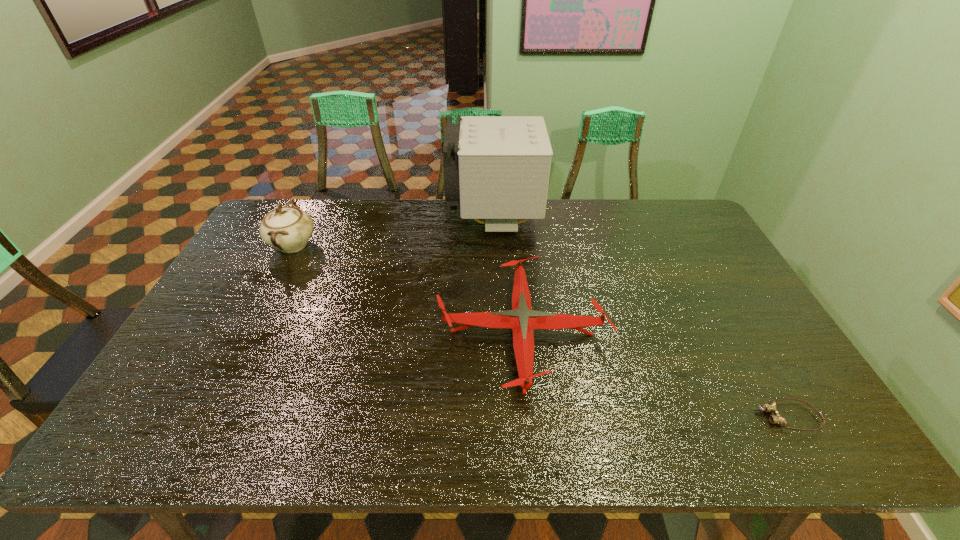
This screenshot has height=540, width=960. In order to click on free location located 0.090m on the front lenses and sides of the rightmost object in this screenshot , I will do `click(720, 417)`.

I want to click on vacant point located on the front lenses and sides of the rightmost object, so click(729, 417).

This screenshot has width=960, height=540. I want to click on fan that is positioned at the far edge, so click(497, 168).

Identify the location of chinaware that is at the far edge. (288, 229).

Locate an element on the screen. The image size is (960, 540). object that is at the near edge is located at coordinates (771, 407).

At what (x,y) coordinates should I click in order to perform the action: click on object that is at the left edge. Please return your answer as a coordinate pair (x, y). This screenshot has height=540, width=960. Looking at the image, I should click on (288, 229).

The image size is (960, 540). Find the location of `object situated at the right edge`. object situated at the right edge is located at coordinates (771, 407).

The width and height of the screenshot is (960, 540). I want to click on object that is at the far left corner, so click(x=288, y=229).

Locate an element on the screen. The width and height of the screenshot is (960, 540). object located at the near right corner is located at coordinates (771, 407).

You are a GUI agent. You are given a task and a screenshot of the screen. Output one action in this format:
    pyautogui.click(x=<x>, y=<y>)
    Task: Click on the vacant space at the far edge of the desktop
    
    Given the screenshot: What is the action you would take?
    pyautogui.click(x=642, y=225)